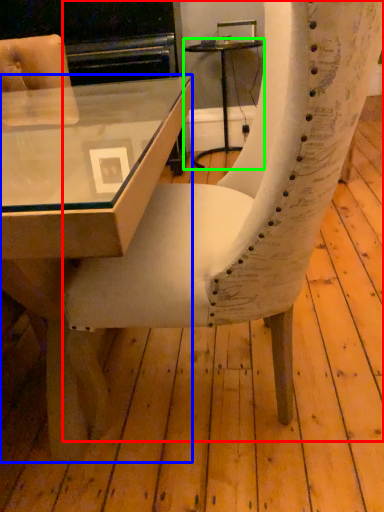
Question: Which object is positioned closest to chair (highlighted by a red box)? Select from table (highlighted by a blue box) and table (highlighted by a green box).

Choices:
 (A) table
 (B) table

Answer: (A)